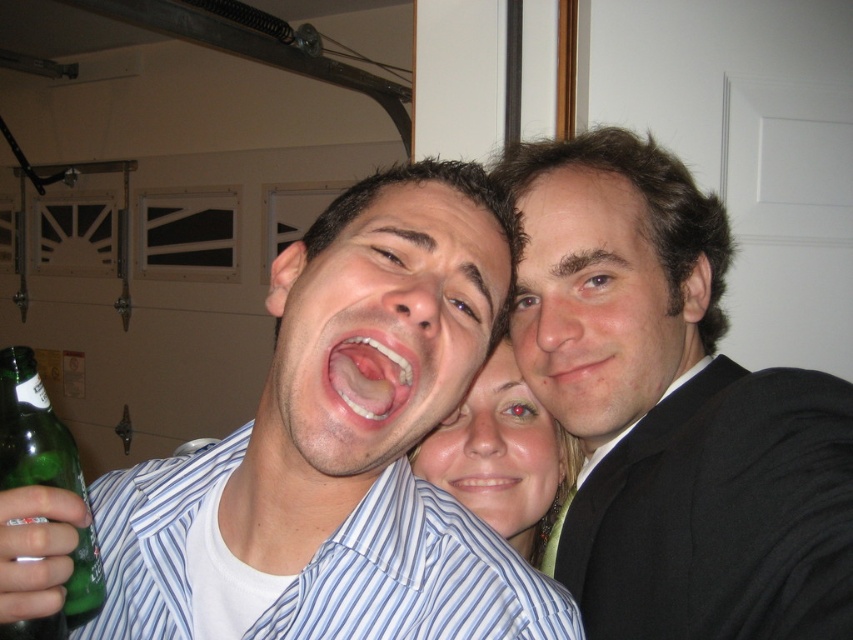
You are a photographer setting up a shoot in the scene described. You need to place a small table between the black suit at right and the green glass bottle at lower left. Based on their sizes, will the table fit comfortably between them?

The black suit at right is much taller than the green glass bottle at lower left, so placing a small table between them should be feasible as there is sufficient vertical space available.

What is located at the coordinates point (677,417) in the image?

The black suit at right is located at point (677,417).

You are standing in a room with three people. You see a black suit at right and a smooth black suit at upper right. Which one is closer to you?

The black suit at right is closer to you because it is in front of the smooth black suit at upper right.